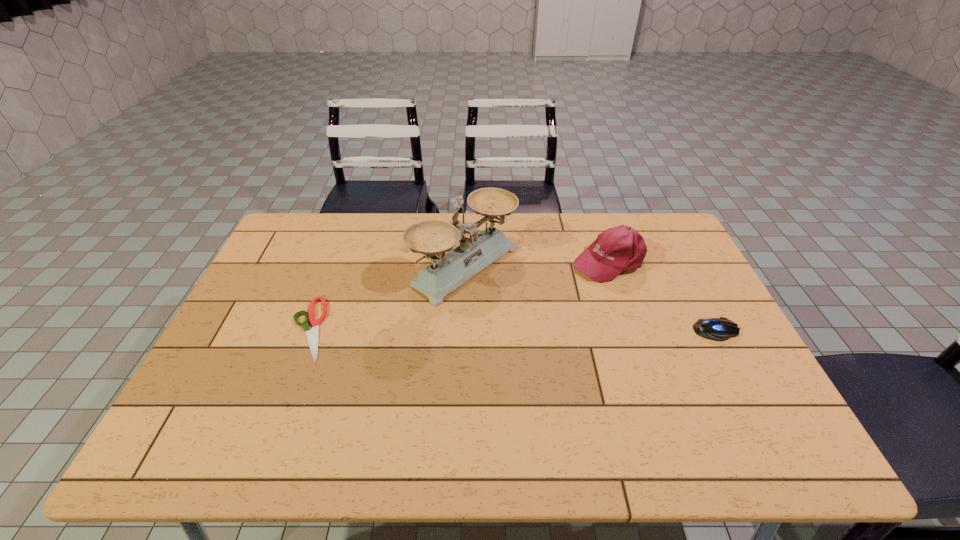
Identify the location of free space between the third shortest object and the shortest object. This screenshot has width=960, height=540. (458, 294).

I want to click on vacant area that lies between the rightmost object and the tallest object, so click(591, 299).

Where is `free space between the second shortest object and the second object from right to left`? The height and width of the screenshot is (540, 960). free space between the second shortest object and the second object from right to left is located at coordinates (661, 295).

Where is `free space between the third object from right to left and the scissors`? The width and height of the screenshot is (960, 540). free space between the third object from right to left and the scissors is located at coordinates (388, 298).

Image resolution: width=960 pixels, height=540 pixels. I want to click on empty space between the computer mouse and the third shortest object, so click(661, 295).

Where is `free area in between the leftmost object and the tallest object`? free area in between the leftmost object and the tallest object is located at coordinates (388, 298).

This screenshot has height=540, width=960. In order to click on vacant area that lies between the shortest object and the scale in this screenshot , I will do click(388, 298).

Where is `the closest object to the third tallest object`? The image size is (960, 540). the closest object to the third tallest object is located at coordinates (618, 249).

In order to click on object that is the third closest to the third object from left to right in this screenshot , I will do coord(312,335).

Identify the location of free space that satisfies the following two spatial constraints: 1. on the front side of the rightmost object; 2. on the button side of the scale. (465, 330).